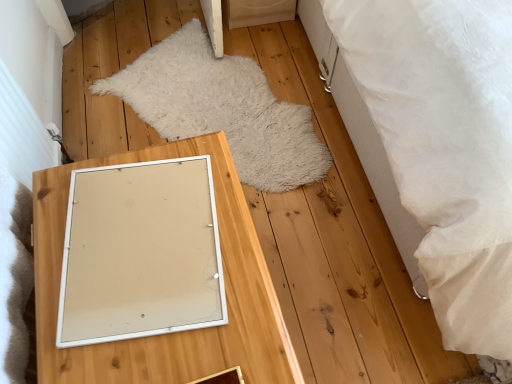
Question: Is white fluffy rug at center not close to white matte picture frame at center?

Choices:
 (A) yes
 (B) no

Answer: (B)

Question: Is the position of white fluffy rug at center more distant than that of white matte picture frame at center?

Choices:
 (A) no
 (B) yes

Answer: (B)

Question: Is white fluffy rug at center facing away from white matte picture frame at center?

Choices:
 (A) no
 (B) yes

Answer: (A)

Question: From the image's perspective, does white fluffy rug at center appear lower than white matte picture frame at center?

Choices:
 (A) no
 (B) yes

Answer: (A)

Question: Is white fluffy rug at center in contact with white matte picture frame at center?

Choices:
 (A) no
 (B) yes

Answer: (A)

Question: Is point (212, 246) positioned closer to the camera than point (434, 213)?

Choices:
 (A) closer
 (B) farther

Answer: (A)

Question: Is white matte picture frame at center wider or thinner than white textured bed at right?

Choices:
 (A) wide
 (B) thin

Answer: (B)

Question: Considering the relative positions of white matte picture frame at center and white textured bed at right in the image provided, is white matte picture frame at center to the left or to the right of white textured bed at right?

Choices:
 (A) left
 (B) right

Answer: (A)

Question: Considering the positions of white matte picture frame at center and white textured bed at right in the image, is white matte picture frame at center taller or shorter than white textured bed at right?

Choices:
 (A) short
 (B) tall

Answer: (A)

Question: In terms of width, does white matte picture frame at center look wider or thinner when compared to wooden mirror at center?

Choices:
 (A) wide
 (B) thin

Answer: (B)

Question: In terms of size, does white matte picture frame at center appear bigger or smaller than wooden mirror at center?

Choices:
 (A) big
 (B) small

Answer: (B)

Question: Is white matte picture frame at center in front of or behind wooden mirror at center in the image?

Choices:
 (A) behind
 (B) front

Answer: (A)

Question: Is white matte picture frame at center spatially inside wooden mirror at center, or outside of it?

Choices:
 (A) inside
 (B) outside

Answer: (A)

Question: Is white textured bed at right taller or shorter than wooden mirror at center?

Choices:
 (A) short
 (B) tall

Answer: (B)

Question: Considering the positions of white textured bed at right and wooden mirror at center in the image, is white textured bed at right bigger or smaller than wooden mirror at center?

Choices:
 (A) small
 (B) big

Answer: (B)